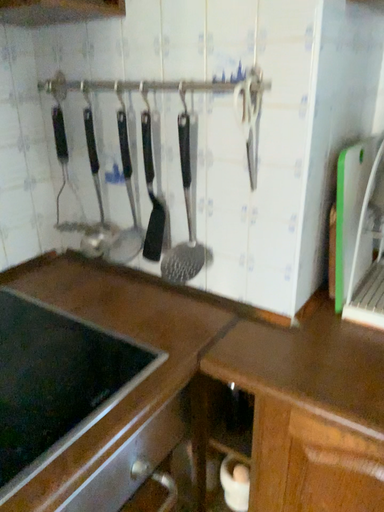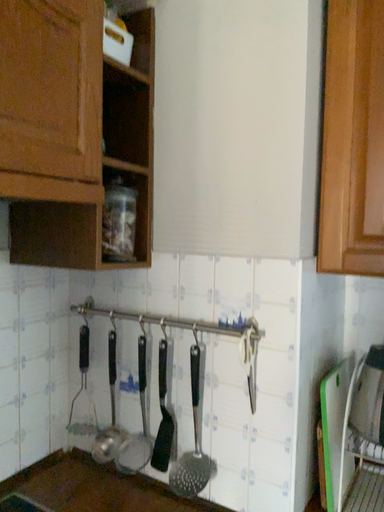
Question: Which way did the camera rotate in the video?

Choices:
 (A) rotated upward
 (B) rotated downward

Answer: (A)